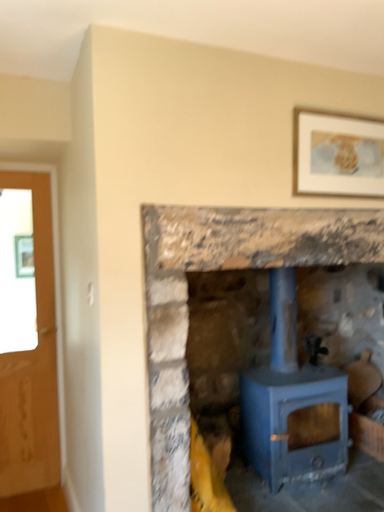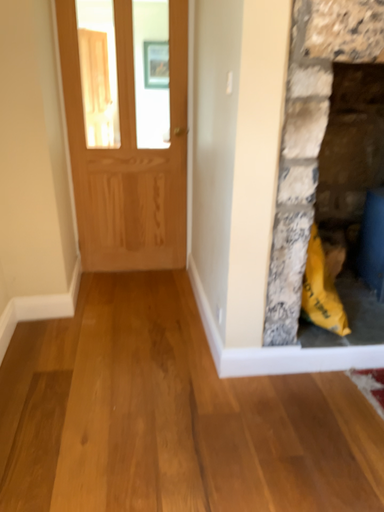
Question: Which way did the camera rotate in the video?

Choices:
 (A) rotated upward
 (B) rotated downward

Answer: (B)